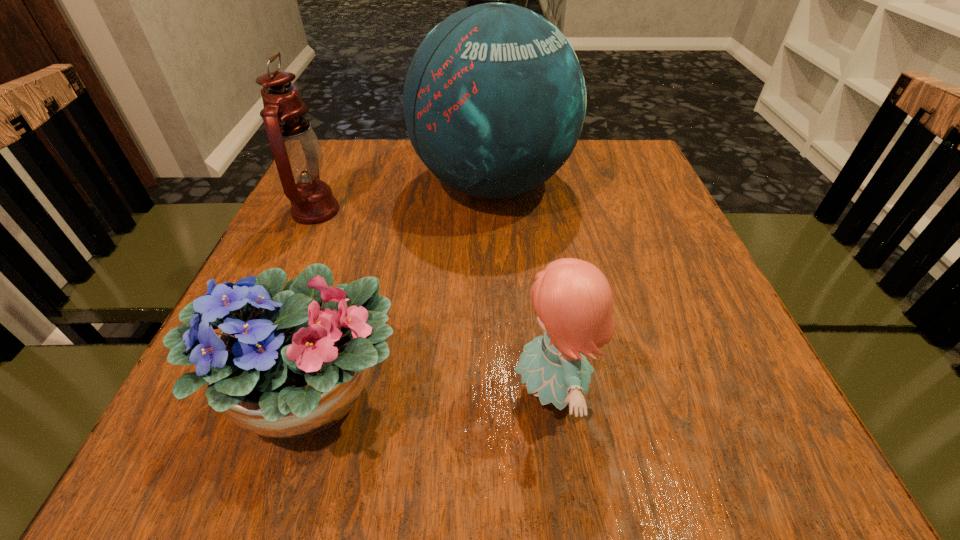
Find the location of `object that is the third closest one to the doll`. object that is the third closest one to the doll is located at coordinates (297, 152).

Identify which object is located as the second nearest to the doll. Please provide its 2D coordinates. Your answer should be formatted as a tuple, i.e. [(x, y)], where the tuple contains the x and y coordinates of a point satisfying the conditions above.

[(494, 100)]

I want to click on free location that satisfies the following two spatial constraints: 1. on the front side of the shortest object; 2. on the left side of the second tallest object, so click(231, 395).